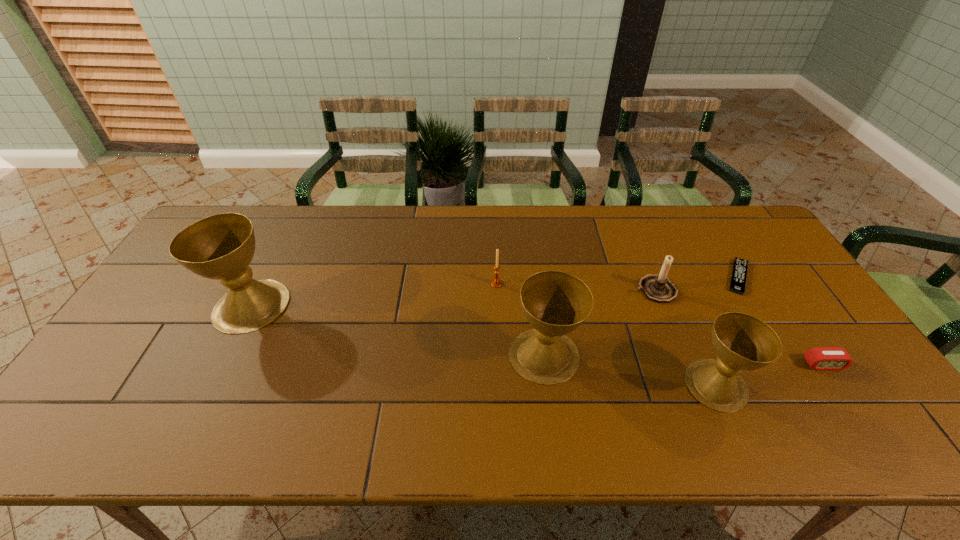
Image resolution: width=960 pixels, height=540 pixels. I want to click on free location located 0.150m on the left of the sixth shortest object, so click(451, 355).

You are a GUI agent. You are given a task and a screenshot of the screen. Output one action in this format:
    pyautogui.click(x=<x>, y=<y>)
    Task: Click on the free location located on the back of the fifth shortest object
    This screenshot has height=540, width=960.
    Given the screenshot: What is the action you would take?
    pyautogui.click(x=683, y=309)

Where is `free space located on the front of the right candle_holder`? The width and height of the screenshot is (960, 540). free space located on the front of the right candle_holder is located at coordinates (672, 334).

Image resolution: width=960 pixels, height=540 pixels. Identify the location of vacant space located on the back of the shortest object. (699, 212).

At what (x,y) coordinates should I click in order to perform the action: click on vacant space located on the front-facing side of the alarm clock. Please return your answer as a coordinate pair (x, y). The height and width of the screenshot is (540, 960). Looking at the image, I should click on [852, 407].

Image resolution: width=960 pixels, height=540 pixels. What are the coordinates of `free region located 0.240m on the right of the second object from left to right` in the screenshot? It's located at tap(582, 284).

Locate an element on the screen. The height and width of the screenshot is (540, 960). remote control present at the right edge is located at coordinates (738, 280).

At what (x,y) coordinates should I click in order to perform the action: click on alarm clock that is at the right edge. Please return your answer as a coordinate pair (x, y). Looking at the image, I should click on (820, 358).

Where is `vacant point at the far edge`? Image resolution: width=960 pixels, height=540 pixels. vacant point at the far edge is located at coordinates (347, 220).

In the image, there is a desktop. Find the location of `vacant space at the near edge`. vacant space at the near edge is located at coordinates (572, 390).